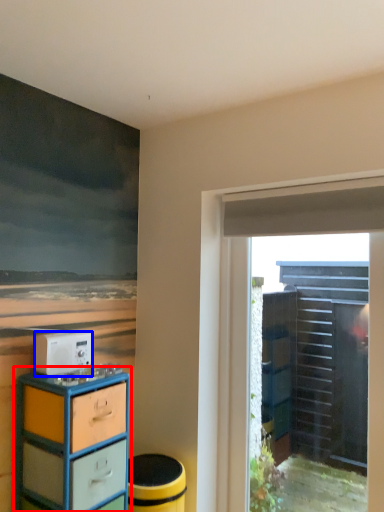
Question: Which object appears closest to the camera in this image, chest of drawers (highlighted by a red box) or appliance (highlighted by a blue box)?

Choices:
 (A) chest of drawers
 (B) appliance

Answer: (A)